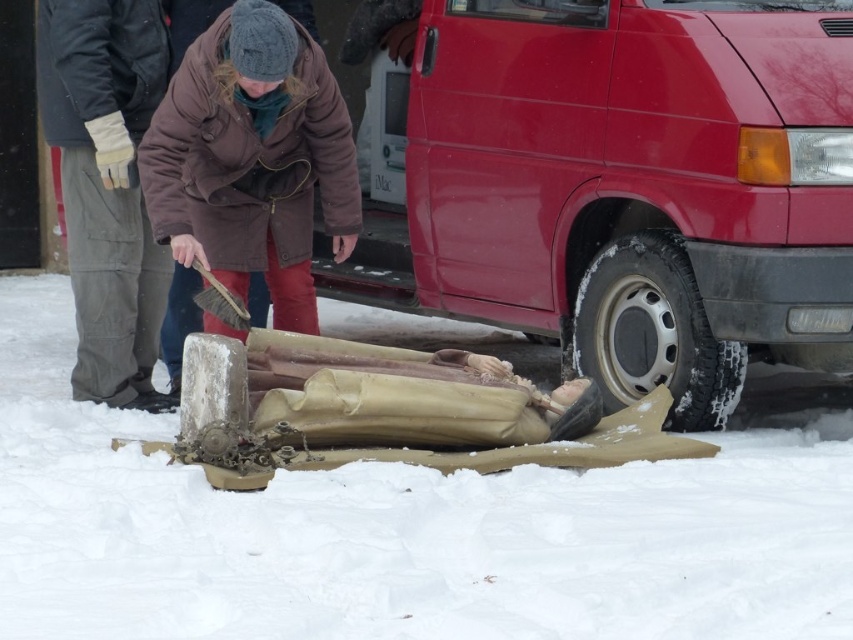
You are standing at the point marked as point (575, 204) in the snowy scene. You want to walk towards the person cleaning the machinery. How far will you have to walk to reach them?

The distance of point (575, 204) from viewer is 7.98 meters, so you will have to walk 7.98 meters to reach the person cleaning the machinery.

Please describe the location of the white matte snow at center in terms of coordinates within the image. Use the coordinate system where the bottom left corner is the origin point.

The white matte snow at center is located at coordinates approximately at point 0.823 on the x axis and 0.484 on the y axis.